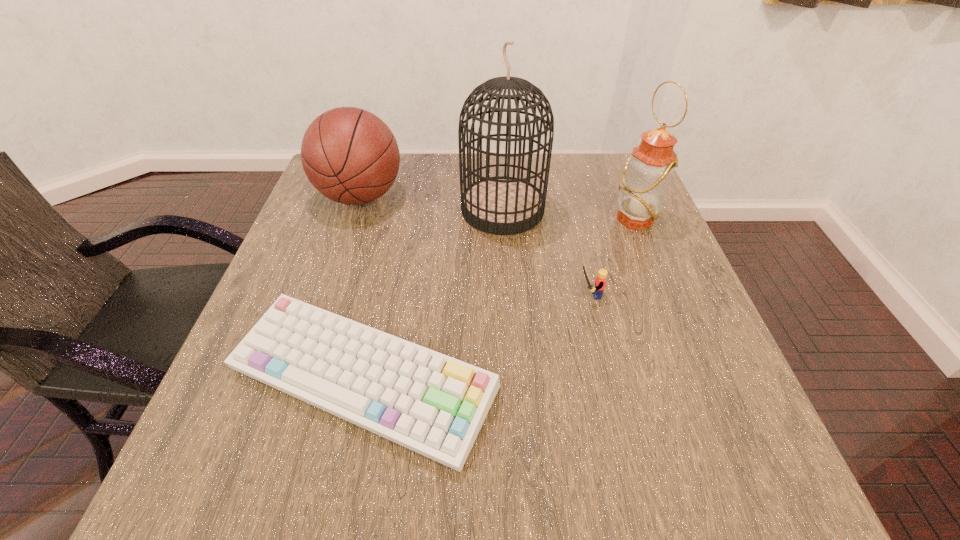
I want to click on the tallest object, so click(501, 205).

Locate an element on the screen. This screenshot has width=960, height=540. oil lamp is located at coordinates (647, 174).

Image resolution: width=960 pixels, height=540 pixels. Find the location of `the second tallest object`. the second tallest object is located at coordinates click(647, 174).

Where is `the third shortest object`? the third shortest object is located at coordinates (349, 155).

Where is `the second object from right to left`? the second object from right to left is located at coordinates (600, 281).

The width and height of the screenshot is (960, 540). What are the coordinates of `Lego` in the screenshot? It's located at click(x=600, y=281).

Identify the location of computer keyboard. (433, 404).

Where is `the shortest object`? The image size is (960, 540). the shortest object is located at coordinates (433, 404).

At what (x,y) coordinates should I click in order to perform the action: click on free space located 0.390m on the left of the birdcage. Please return your answer as a coordinate pair (x, y). The height and width of the screenshot is (540, 960). Looking at the image, I should click on (309, 209).

Identify the location of blank area located on the left of the rightmost object. The width and height of the screenshot is (960, 540). (537, 219).